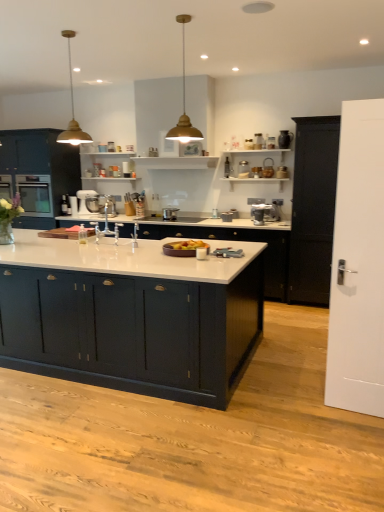
Describe the element at coordinates (35, 194) in the screenshot. I see `satin black oven at left` at that location.

What do you see at coordinates (101, 204) in the screenshot? I see `brushed metal sink at center, the second appliance in the left-to-right sequence` at bounding box center [101, 204].

At what (x,y) coordinates should I click in order to perform the action: click on gold metallic pendant light at upper center, which is the second light fixture from left to right. Please return your answer as a coordinate pair (x, y). Looking at the image, I should click on (184, 104).

The height and width of the screenshot is (512, 384). What do you see at coordinates (184, 104) in the screenshot?
I see `gold metallic pendant light at upper center, the 1th light fixture viewed from the right` at bounding box center [184, 104].

What do you see at coordinates (37, 174) in the screenshot? I see `matte dark blue cabinets at left, which is the first cabinetry in back-to-front order` at bounding box center [37, 174].

This screenshot has height=512, width=384. In order to click on satin black oven at left in this screenshot , I will do `click(35, 194)`.

From the image's perspective, is satin black oven at left on top of satin silver coffee maker at center, arranged as the 5th appliance when viewed from the left?

Indeed, from the image's perspective, satin black oven at left is shown above satin silver coffee maker at center, arranged as the 5th appliance when viewed from the left.

Does satin black oven at left appear on the right side of satin silver coffee maker at center, arranged as the 5th appliance when viewed from the left?

No.

Can you confirm if satin black oven at left is taller than satin silver coffee maker at center, positioned as the 2th appliance in right-to-left order?

Correct, satin black oven at left is much taller as satin silver coffee maker at center, positioned as the 2th appliance in right-to-left order.

Based on the photo, is satin black oven at left spatially inside satin silver coffee maker at center, positioned as the 2th appliance in right-to-left order, or outside of it?

satin black oven at left is not inside satin silver coffee maker at center, positioned as the 2th appliance in right-to-left order, it's outside.

Is white glossy sink at center closer to the viewer compared to satin black oven at left?

Yes, white glossy sink at center is closer to the camera.

From a real-world perspective, does white glossy sink at center stand above satin black oven at left?

No, from a real-world perspective, white glossy sink at center is not on top of satin black oven at left.

Is white glossy sink at center wider or thinner than satin black oven at left?

Clearly, white glossy sink at center has less width compared to satin black oven at left.

Between white glossy sink at center and satin black oven at left, which one has less height?

white glossy sink at center.

Is gold metal pendant light at upper center, which is the first light fixture from left to right, in front of or behind matte glass jar at upper center, positioned as the 4th appliance in left-to-right order, in the image?

Visually, gold metal pendant light at upper center, which is the first light fixture from left to right, is located in front of matte glass jar at upper center, positioned as the 4th appliance in left-to-right order.

Would you say gold metal pendant light at upper center, which is the first light fixture from left to right, is to the left or to the right of matte glass jar at upper center, the third appliance positioned from the right, in the picture?

gold metal pendant light at upper center, which is the first light fixture from left to right, is positioned on matte glass jar at upper center, the third appliance positioned from the right,'s left side.

Identify the location of the 1st appliance positioned below the gold metal pendant light at upper center, which is the first light fixture from left to right (from the image's perspective). Image resolution: width=384 pixels, height=512 pixels. (243, 169).

Considering the sizes of gold metal pendant light at upper center, which is the first light fixture from left to right, and matte glass jar at upper center, positioned as the 4th appliance in left-to-right order, in the image, is gold metal pendant light at upper center, which is the first light fixture from left to right, bigger or smaller than matte glass jar at upper center, positioned as the 4th appliance in left-to-right order,?

In the image, gold metal pendant light at upper center, which is the first light fixture from left to right, appears to be larger than matte glass jar at upper center, positioned as the 4th appliance in left-to-right order.

Considering the positions of points (280, 139) and (264, 211), is point (280, 139) closer to camera compared to point (264, 211)?

No, (280, 139) is further to viewer.

Considering the sizes of objects matte black kettle at upper right, which is the 6th appliance from left to right, and satin silver coffee maker at center, arranged as the 5th appliance when viewed from the left, in the image provided, who is taller, matte black kettle at upper right, which is the 6th appliance from left to right, or satin silver coffee maker at center, arranged as the 5th appliance when viewed from the left,?

matte black kettle at upper right, which is the 6th appliance from left to right.

From a real-world perspective, is matte black kettle at upper right, which is the 6th appliance from left to right, positioned under satin silver coffee maker at center, arranged as the 5th appliance when viewed from the left, based on gravity?

Actually, matte black kettle at upper right, which is the 6th appliance from left to right, is physically above satin silver coffee maker at center, arranged as the 5th appliance when viewed from the left, in the real world.

Does point (248, 167) lie behind point (202, 139)?

No, (248, 167) is closer to viewer.

Is matte glass jar at upper center, the third appliance positioned from the right, far away from gold metallic pendant light at upper center, which is the second light fixture from left to right?

Actually, matte glass jar at upper center, the third appliance positioned from the right, and gold metallic pendant light at upper center, which is the second light fixture from left to right, are a little close together.

From a real-world perspective, is matte glass jar at upper center, positioned as the 4th appliance in left-to-right order, physically located above or below gold metallic pendant light at upper center, which is the second light fixture from left to right?

matte glass jar at upper center, positioned as the 4th appliance in left-to-right order, is below gold metallic pendant light at upper center, which is the second light fixture from left to right.

In terms of size, does matte glass jar at upper center, positioned as the 4th appliance in left-to-right order, appear bigger or smaller than gold metallic pendant light at upper center, which is the second light fixture from left to right?

Clearly, matte glass jar at upper center, positioned as the 4th appliance in left-to-right order, is smaller in size than gold metallic pendant light at upper center, which is the second light fixture from left to right.

From a real-world perspective, which is physically above, matte black kettle at upper right, which is the 6th appliance from left to right, or satin black oven at left?

matte black kettle at upper right, which is the 6th appliance from left to right, is physically above.

Considering the sizes of objects matte black kettle at upper right, which is the 6th appliance from left to right, and satin black oven at left in the image provided, who is thinner, matte black kettle at upper right, which is the 6th appliance from left to right, or satin black oven at left?

matte black kettle at upper right, which is the 6th appliance from left to right, is thinner.

From the image's perspective, is matte black kettle at upper right, which is the 6th appliance from left to right, located beneath satin black oven at left?

Incorrect, from the image's perspective, matte black kettle at upper right, which is the 6th appliance from left to right, is higher than satin black oven at left.

Is matte black kettle at upper right, the 1th appliance viewed from the right, situated inside satin black oven at left or outside?

matte black kettle at upper right, the 1th appliance viewed from the right, is spatially situated outside satin black oven at left.

Is matte black kettle at upper right, which is the 6th appliance from left to right, at the back of silver metallic pot at center, marked as the third appliance in a left-to-right arrangement?

That's not correct — silver metallic pot at center, marked as the third appliance in a left-to-right arrangement, is not looking away from matte black kettle at upper right, which is the 6th appliance from left to right.

From the image's perspective, is silver metallic pot at center, marked as the third appliance in a left-to-right arrangement, beneath matte black kettle at upper right, the 1th appliance viewed from the right?

Correct, silver metallic pot at center, marked as the third appliance in a left-to-right arrangement, appears lower than matte black kettle at upper right, the 1th appliance viewed from the right, in the image.

Based on the photo, which object is wider, silver metallic pot at center, marked as the third appliance in a left-to-right arrangement, or matte black kettle at upper right, the 1th appliance viewed from the right?

silver metallic pot at center, marked as the third appliance in a left-to-right arrangement.

From the image's perspective, which appliance is the 4th one below the satin black oven at left? Please provide its 2D coordinates.

[(259, 213)]

You are a GUI agent. You are given a task and a screenshot of the screen. Output one action in this format:
    pyautogui.click(x=<x>, y=<y>)
    Task: Click on the sink located underneath the satin black oven at left (from a real-world perspective)
    The image size is (384, 512).
    Given the screenshot: What is the action you would take?
    pyautogui.click(x=107, y=228)

Looking at the image, which one is located closer to matte black kettle at upper right, the 1th appliance viewed from the right, matte dark blue cabinet at center, acting as the fourth cabinetry starting from the back, or satin silver coffee maker at center, positioned as the 2th appliance in right-to-left order?

Among the two, satin silver coffee maker at center, positioned as the 2th appliance in right-to-left order, is located nearer to matte black kettle at upper right, the 1th appliance viewed from the right.

Considering their positions, is satin silver coffee maker at center, arranged as the 5th appliance when viewed from the left, positioned closer to metallic silver stand mixer at center, the 6th appliance from the right, than white glossy countertop at center, which appears as the 3th cabinetry when viewed from the front?

The object closer to metallic silver stand mixer at center, the 6th appliance from the right, is white glossy countertop at center, which appears as the 3th cabinetry when viewed from the front.

When comparing their distances from white glossy sink at center, does brushed metal sink at center, the second appliance in the left-to-right sequence, or white glossy countertop at center, which appears as the 3th cabinetry when viewed from the front, seem further?

Among the two, white glossy countertop at center, which appears as the 3th cabinetry when viewed from the front, is located further to white glossy sink at center.

Which object lies nearer to the anchor point matte dark blue cabinets at left, which is counted as the 4th cabinetry, starting from the front, gold metal pendant light at upper center, which is the first light fixture from left to right, or matte glass jar at upper center, the third appliance positioned from the right?

Among the two, gold metal pendant light at upper center, which is the first light fixture from left to right, is located nearer to matte dark blue cabinets at left, which is counted as the 4th cabinetry, starting from the front.

Estimate the real-world distances between objects in this image. Which object is further from white glossy countertop at center, which ranks as the 2th cabinetry in back-to-front order, satin black oven at left or matte dark blue cabinets at left, which is counted as the 4th cabinetry, starting from the front?

matte dark blue cabinets at left, which is counted as the 4th cabinetry, starting from the front, is further to white glossy countertop at center, which ranks as the 2th cabinetry in back-to-front order.

Based on their spatial positions, is black wood door at right, acting as the second cabinetry starting from the front, or white matte door at right further from brushed metal sink at center, the second appliance in the left-to-right sequence?

white matte door at right is positioned further to the anchor brushed metal sink at center, the second appliance in the left-to-right sequence.

Based on their spatial positions, is satin black oven at left or white matte door at right further from black wood door at right, acting as the second cabinetry starting from the front?

satin black oven at left lies further to black wood door at right, acting as the second cabinetry starting from the front, than the other object.

From the picture: From the image, which object appears to be farther from metallic silver stand mixer at center, the 6th appliance from the right, satin black oven at left or matte dark blue cabinets at left, which is the first cabinetry in back-to-front order?

satin black oven at left is positioned further to the anchor metallic silver stand mixer at center, the 6th appliance from the right.

The image size is (384, 512). Find the location of `sink between gold metallic pendant light at upper center, the 1th light fixture viewed from the right, and matte glass jar at upper center, the third appliance positioned from the right, in the front-back direction`. sink between gold metallic pendant light at upper center, the 1th light fixture viewed from the right, and matte glass jar at upper center, the third appliance positioned from the right, in the front-back direction is located at coordinates (107, 228).

Where is `sink between matte dark blue cabinet at center, acting as the fourth cabinetry starting from the back, and black wood door at right, the third cabinetry from the back, from left to right`? This screenshot has height=512, width=384. sink between matte dark blue cabinet at center, acting as the fourth cabinetry starting from the back, and black wood door at right, the third cabinetry from the back, from left to right is located at coordinates (107, 228).

Locate an element on the screen. sink between gold metallic pendant light at upper center, the 1th light fixture viewed from the right, and matte black kettle at upper right, which is the 6th appliance from left to right, along the z-axis is located at coordinates (107, 228).

Where is `sink between gold metal pendant light at upper center, acting as the second light fixture starting from the right, and satin silver coffee maker at center, arranged as the 5th appliance when viewed from the left, along the z-axis`? The width and height of the screenshot is (384, 512). sink between gold metal pendant light at upper center, acting as the second light fixture starting from the right, and satin silver coffee maker at center, arranged as the 5th appliance when viewed from the left, along the z-axis is located at coordinates (107, 228).